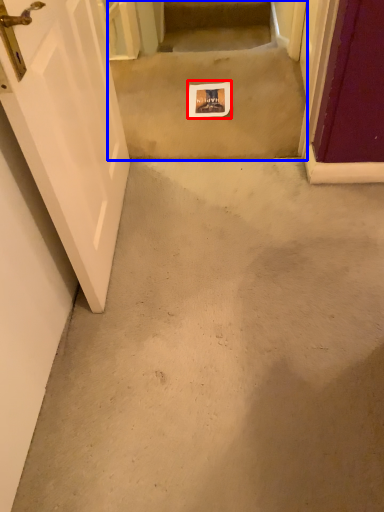
Question: Which of the following is the closest to the observer, postcard (highlighted by a red box) or stairwell (highlighted by a blue box)?

Choices:
 (A) postcard
 (B) stairwell

Answer: (B)